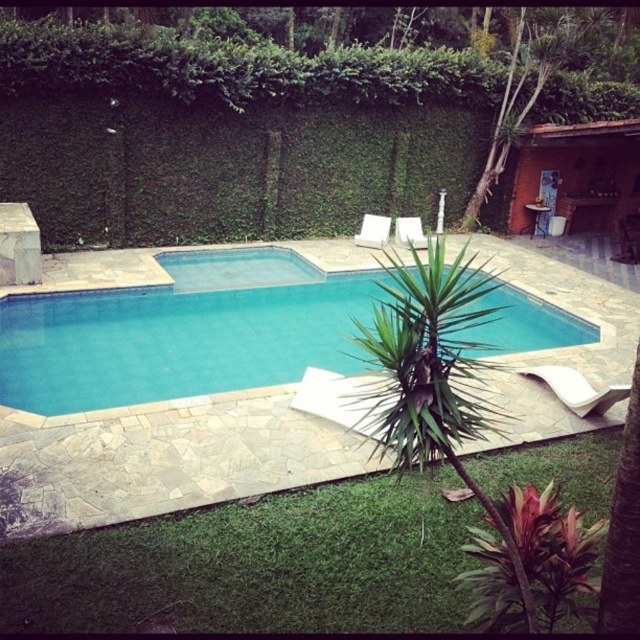
You are a guest at a backyard party and want to take a photo of the blue smooth pool at center without the green leafy hedge at upper center blocking the view. Where should you move to get an unobstructed view?

Move to a position below the green leafy hedge at upper center so that the blue smooth pool at center is visible without obstruction from the hedge.

You are designing a garden layout and want to ensure the green leafy hedge at upper center and the blue smooth pool at center are visible from the main entrance. Since the hedge is taller, will it block the view of the pool?

The green leafy hedge at upper center is taller than the blue smooth pool at center, so it may block the view of the pool from the main entrance depending on their positions.

You are standing in the backyard and want to walk from the green leafy hedge at upper center to the blue smooth pool at center. Which direction should you move to get closer to the pool?

You should move backward because the green leafy hedge at upper center is closer to you than the blue smooth pool at center, so moving away from the hedge towards the pool would require stepping back.